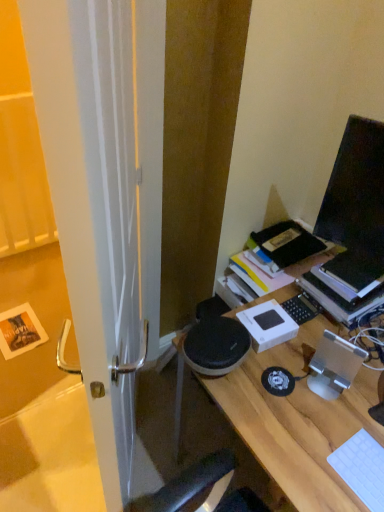
I want to click on hardcover book at upper right, so click(340, 298).

This screenshot has width=384, height=512. Find the location of `wooden desk at center`. wooden desk at center is located at coordinates (297, 421).

At what (x,y) coordinates should I click in order to perform the action: click on white glossy door at left. Please return your answer as a coordinate pair (x, y). Image resolution: width=384 pixels, height=512 pixels. Looking at the image, I should click on (95, 204).

The height and width of the screenshot is (512, 384). What do you see at coordinates (95, 204) in the screenshot?
I see `white glossy door at left` at bounding box center [95, 204].

The width and height of the screenshot is (384, 512). I want to click on white plastic keyboard at lower right, so click(x=362, y=468).

Locate an element on the screen. Image resolution: width=384 pixels, height=512 pixels. black glossy monitor at upper right is located at coordinates (356, 191).

Image resolution: width=384 pixels, height=512 pixels. What do you see at coordinates (356, 191) in the screenshot?
I see `black glossy monitor at upper right` at bounding box center [356, 191].

At what (x,y) coordinates should I click in order to perform the action: click on hardcover book at upper right. Please return your answer as a coordinate pair (x, y). The height and width of the screenshot is (512, 384). Looking at the image, I should click on (340, 298).

Is white glossy door at left not close to white plastic keyboard at lower right?

No, there isn't a large distance between white glossy door at left and white plastic keyboard at lower right.

From a real-world perspective, is white glossy door at left physically above white plastic keyboard at lower right?

Yes, from a real-world perspective, white glossy door at left is on top of white plastic keyboard at lower right.

Is white glossy door at left aimed at white plastic keyboard at lower right?

No, white glossy door at left is not turned towards white plastic keyboard at lower right.

Is black glossy monitor at upper right inside the boundaries of white glossy door at left, or outside?

black glossy monitor at upper right exists outside the volume of white glossy door at left.

Between black glossy monitor at upper right and white glossy door at left, which one has less height?

With less height is black glossy monitor at upper right.

Is point (363, 201) more distant than point (132, 89)?

No, it is not.

From a real-world perspective, which is physically above, black glossy monitor at upper right or white glossy door at left?

black glossy monitor at upper right is physically above.

Considering the relative sizes of wooden desk at center and white glossy door at left in the image provided, is wooden desk at center shorter than white glossy door at left?

Indeed, wooden desk at center has a lesser height compared to white glossy door at left.

Is wooden desk at center oriented away from white glossy door at left?

No, white glossy door at left is not at the back of wooden desk at center.

This screenshot has height=512, width=384. I want to click on desk below the white glossy door at left (from a real-world perspective), so [x=297, y=421].

Is point (347, 419) closer to camera compared to point (112, 42)?

That is False.

Which is more to the left, wooden desk at center or black glossy monitor at upper right?

wooden desk at center is more to the left.

Which point is more forward, (334, 412) or (374, 129)?

Point (374, 129)

What's the angular difference between wooden desk at center and black glossy monitor at upper right's facing directions?

19.4 degrees.

Considering the sizes of white plastic keyboard at lower right and white glossy door at left in the image, is white plastic keyboard at lower right wider or thinner than white glossy door at left?

Considering their sizes, white plastic keyboard at lower right looks broader than white glossy door at left.

Can you see white plastic keyboard at lower right touching white glossy door at left?

white plastic keyboard at lower right is not next to white glossy door at left, and they're not touching.

Is point (377, 474) less distant than point (62, 178)?

No, it is behind (62, 178).

Which object is positioned more to the right, white glossy door at left or wooden desk at center?

Positioned to the right is wooden desk at center.

From a real-world perspective, who is located lower, white glossy door at left or wooden desk at center?

In real-world perspective, wooden desk at center is lower.

From the image's perspective, which one is positioned higher, white glossy door at left or wooden desk at center?

white glossy door at left is shown above in the image.

Is white glossy door at left far away from wooden desk at center?

white glossy door at left is actually quite close to wooden desk at center.

Locate an element on the screen. This screenshot has height=512, width=384. laptop keyboard on the left side of black glossy monitor at upper right is located at coordinates (362, 468).

Is black glossy monitor at upper right completely or partially inside white plastic keyboard at lower right?

No, black glossy monitor at upper right is not inside white plastic keyboard at lower right.

Can you confirm if white plastic keyboard at lower right is taller than black glossy monitor at upper right?

No, white plastic keyboard at lower right is not taller than black glossy monitor at upper right.

The width and height of the screenshot is (384, 512). Find the location of `laptop keyboard located behind the white glossy door at left`. laptop keyboard located behind the white glossy door at left is located at coordinates (362, 468).

Identify the location of computer monitor located above the white glossy door at left (from a real-world perspective). The image size is (384, 512). (356, 191).

From the image, which object appears to be farther from white plastic keyboard at lower right, white glossy door at left or black glossy monitor at upper right?

Among the two, white glossy door at left is located further to white plastic keyboard at lower right.

Estimate the real-world distances between objects in this image. Which object is further from white plastic keyboard at lower right, wooden desk at center or black glossy monitor at upper right?

The object further to white plastic keyboard at lower right is black glossy monitor at upper right.

Which object lies nearer to the anchor point white glossy door at left, white plastic keyboard at lower right or hardcover book at upper right?

hardcover book at upper right lies closer to white glossy door at left than the other object.

Considering their positions, is white glossy door at left positioned closer to wooden desk at center than white plastic keyboard at lower right?

white plastic keyboard at lower right is closer to wooden desk at center.

Which object lies further to the anchor point white glossy door at left, black glossy monitor at upper right or hardcover book at upper right?

Among the two, hardcover book at upper right is located further to white glossy door at left.

Which object lies nearer to the anchor point wooden desk at center, black glossy monitor at upper right or hardcover book at upper right?

Among the two, hardcover book at upper right is located nearer to wooden desk at center.

When comparing their distances from black glossy monitor at upper right, does white glossy door at left or hardcover book at upper right seem closer?

hardcover book at upper right lies closer to black glossy monitor at upper right than the other object.

Based on their spatial positions, is black glossy monitor at upper right or white plastic keyboard at lower right further from hardcover book at upper right?

white plastic keyboard at lower right lies further to hardcover book at upper right than the other object.

You are a GUI agent. You are given a task and a screenshot of the screen. Output one action in this format:
    pyautogui.click(x=<x>, y=<y>)
    Task: Click on the paperback book that lies between black glossy monitor at upper right and white plastic keyboard at lower right from top to bottom
    The height and width of the screenshot is (512, 384).
    Given the screenshot: What is the action you would take?
    pyautogui.click(x=340, y=298)

Find the location of `computer monitor between white glossy door at left and hardcover book at upper right along the z-axis`. computer monitor between white glossy door at left and hardcover book at upper right along the z-axis is located at coordinates (356, 191).

What are the coordinates of `laptop keyboard between black glossy monitor at upper right and wooden desk at center in the up-down direction` in the screenshot? It's located at (362, 468).

I want to click on laptop keyboard between white glossy door at left and wooden desk at center from left to right, so click(362, 468).